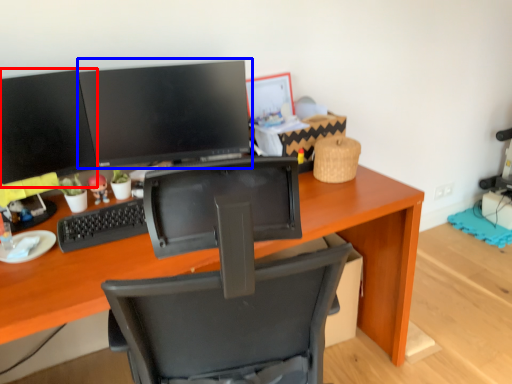
Question: Which object appears farthest to the camera in this image, computer monitor (highlighted by a red box) or computer monitor (highlighted by a blue box)?

Choices:
 (A) computer monitor
 (B) computer monitor

Answer: (B)